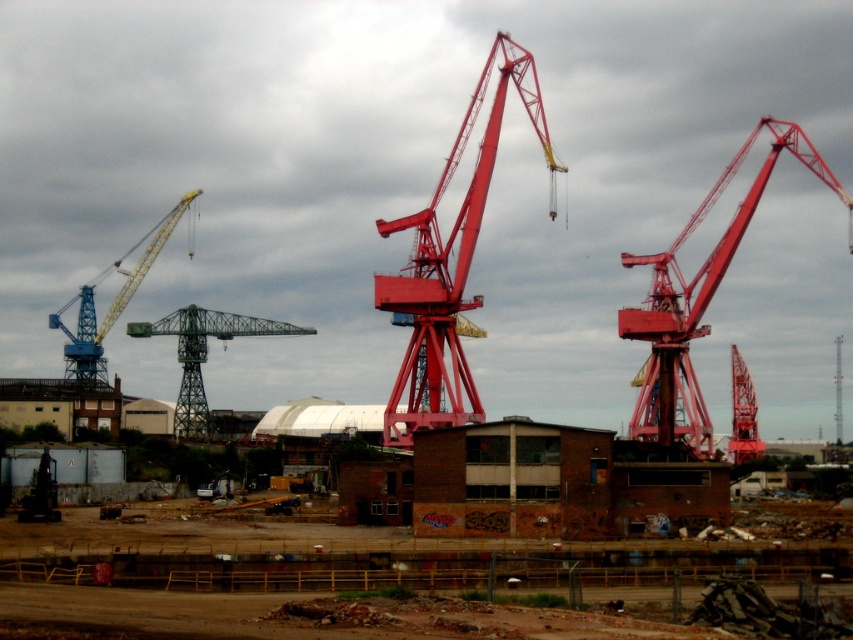
Question: Does metallic red crane at right lie in front of blue metallic crane at left?

Choices:
 (A) yes
 (B) no

Answer: (A)

Question: Can you confirm if green metallic crane at center is positioned above matte red crane at right?

Choices:
 (A) no
 (B) yes

Answer: (B)

Question: Which object appears farthest from the camera in this image?

Choices:
 (A) metallic red crane at right
 (B) matte red crane at right

Answer: (B)

Question: Among these points, which one is nearest to the camera?

Choices:
 (A) (740, 436)
 (B) (660, 392)
 (C) (86, 328)
 (D) (440, 468)

Answer: (D)

Question: Does blue metallic crane at left appear on the right side of matte red crane at right?

Choices:
 (A) yes
 (B) no

Answer: (B)

Question: Considering the real-world distances, which object is closest to the metallic red crane at right?

Choices:
 (A) brick wall at center
 (B) blue metallic crane at left
 (C) metallic red crane at center

Answer: (C)